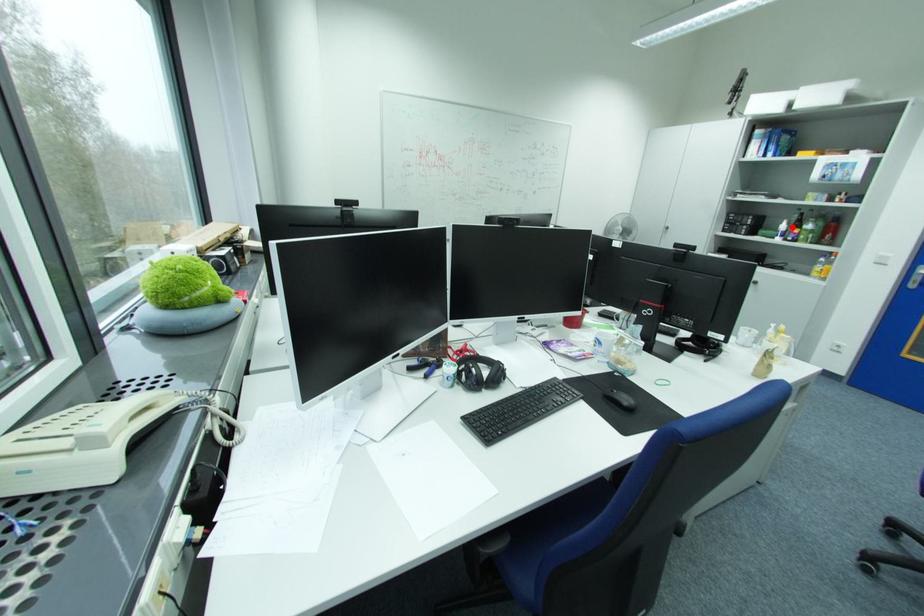
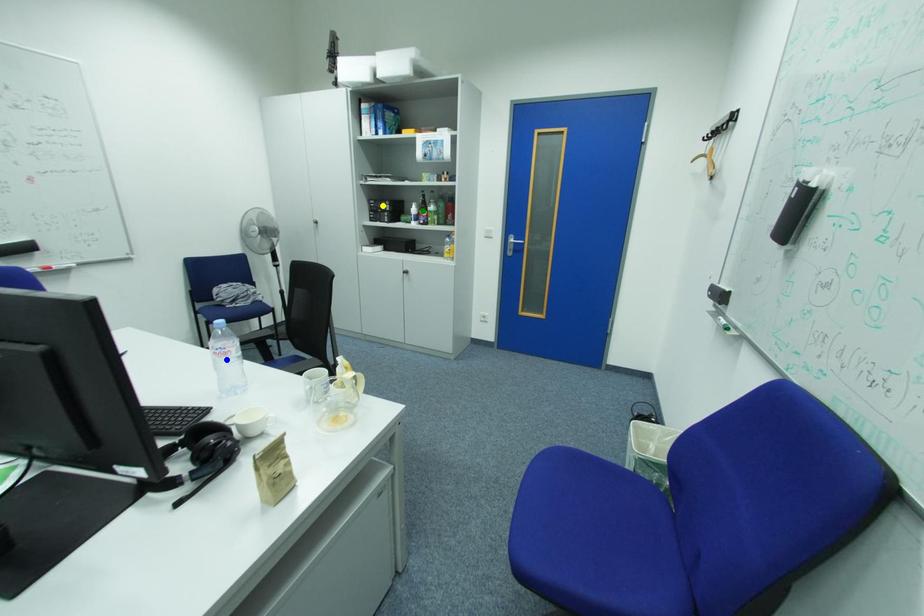
Question: I am providing you with two images of the same scene from different viewpoints. A red point is marked on the first image. You are given multiple points on the second image. In image 2, which mark is for the same physical point as the one in image 1?

Choices:
 (A) blue point
 (B) yellow point
 (C) green point

Answer: (C)